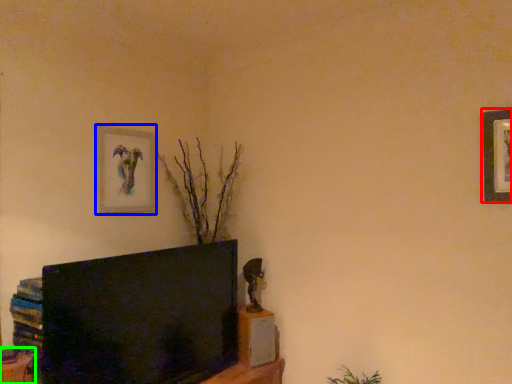
Question: Which object is positioned closest to picture frame (highlighted by a red box)? Select from picture frame (highlighted by a blue box) and furniture (highlighted by a green box).

Choices:
 (A) picture frame
 (B) furniture

Answer: (A)